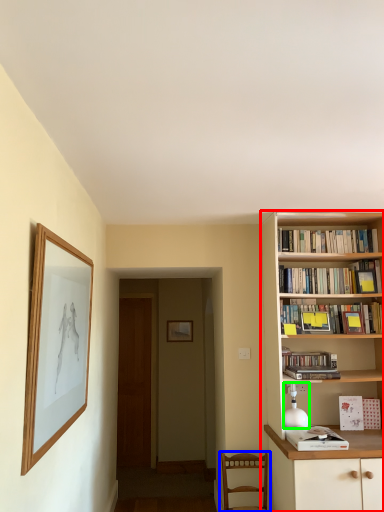
Question: Considering the real-world distances, which object is closest to bookcase (highlighted by a red box)? chair (highlighted by a blue box) or lamp (highlighted by a green box).

Choices:
 (A) chair
 (B) lamp

Answer: (B)